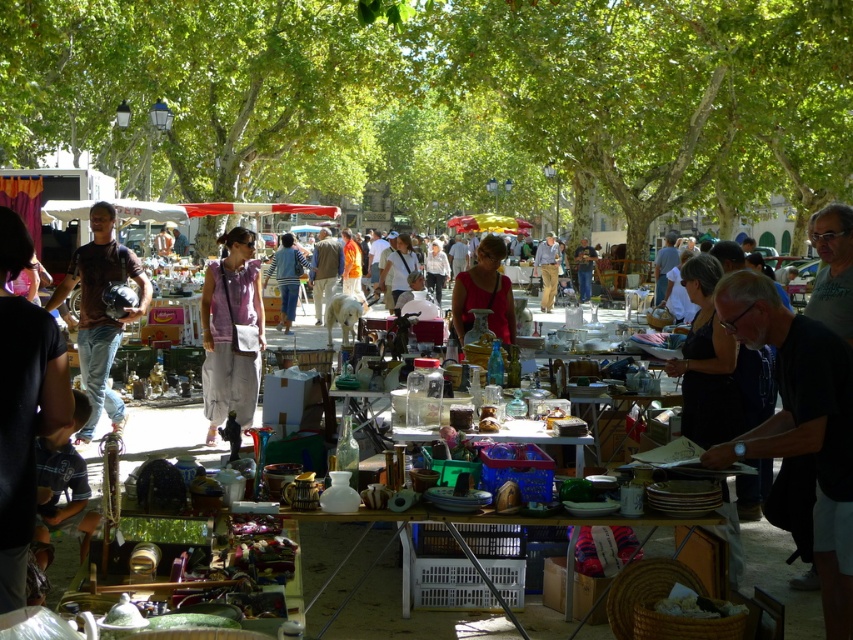
Question: Observing the image, what is the correct spatial positioning of matte black helmet at left in reference to matte red blouse at center?

Choices:
 (A) right
 (B) left

Answer: (B)

Question: Is matte black helmet at left further to the viewer compared to matte red blouse at center?

Choices:
 (A) no
 (B) yes

Answer: (B)

Question: Among these objects, which one is farthest from the camera?

Choices:
 (A) matte black helmet at left
 (B) matte red blouse at center
 (C) purple cotton shirt at center

Answer: (C)

Question: Which of these objects is positioned closest to the purple cotton shirt at center?

Choices:
 (A) matte black helmet at left
 (B) matte red blouse at center

Answer: (A)

Question: Does purple cotton shirt at center have a larger size compared to matte black helmet at left?

Choices:
 (A) no
 (B) yes

Answer: (A)

Question: Which of these objects is positioned farthest from the matte black helmet at left?

Choices:
 (A) purple cotton shirt at center
 (B) matte red blouse at center

Answer: (B)